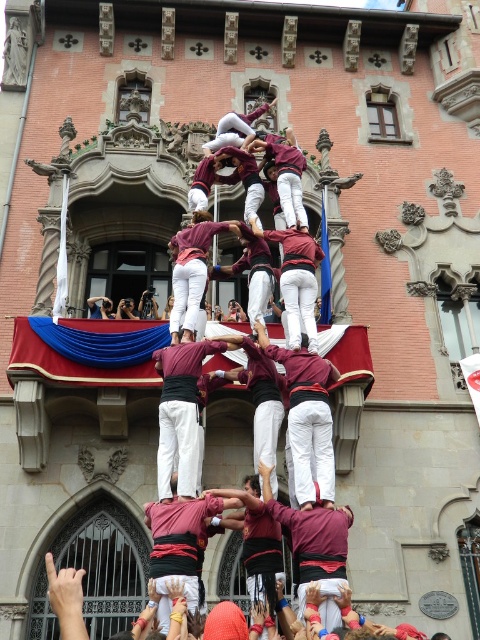
You are a photographer standing in front of the historic building. You want to capture a photo of the maroon fabric at center and the maroon fabric man at center. Which of the two objects is positioned lower in the image?

The maroon fabric at center is positioned lower in the image because it is located below the maroon fabric man at center.